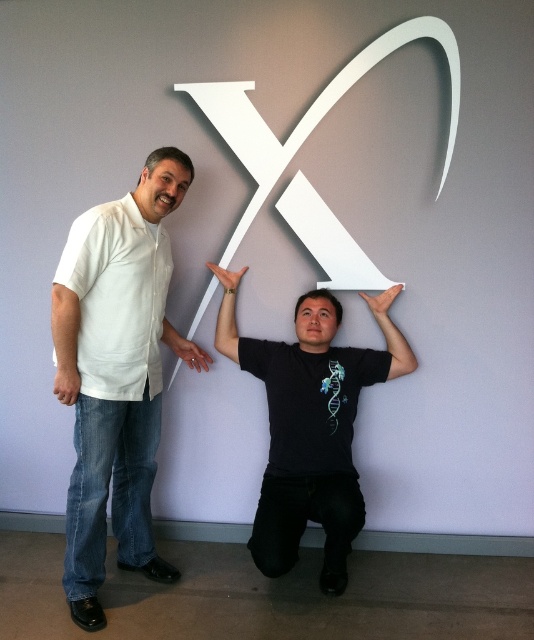
The height and width of the screenshot is (640, 534). What do you see at coordinates (327, 240) in the screenshot?
I see `white matte letter x at center` at bounding box center [327, 240].

Which is below, white matte letter x at center or matte white hand at center?

matte white hand at center is lower down.

The width and height of the screenshot is (534, 640). What do you see at coordinates (327, 240) in the screenshot?
I see `white matte letter x at center` at bounding box center [327, 240].

What are the coordinates of `white matte letter x at center` in the screenshot? It's located at (327, 240).

Who is higher up, white matte letter x at upper center or matte white hand at upper center?

Positioned higher is white matte letter x at upper center.

Find the location of `white matte letter x at upper center`. white matte letter x at upper center is located at coordinates (310, 113).

The height and width of the screenshot is (640, 534). In order to click on white matte letter x at upper center in this screenshot , I will do `click(310, 113)`.

The image size is (534, 640). Describe the element at coordinates (187, 352) in the screenshot. I see `matte white hand at center` at that location.

Is point (202, 369) positioned in front of point (380, 304)?

No, it is behind (380, 304).

What are the coordinates of `matte white hand at center` in the screenshot? It's located at (187, 352).